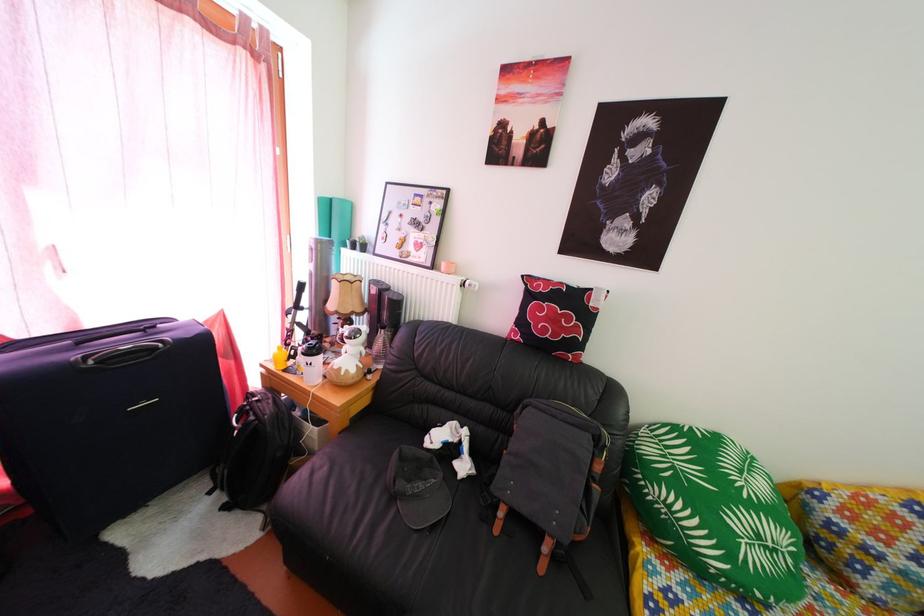
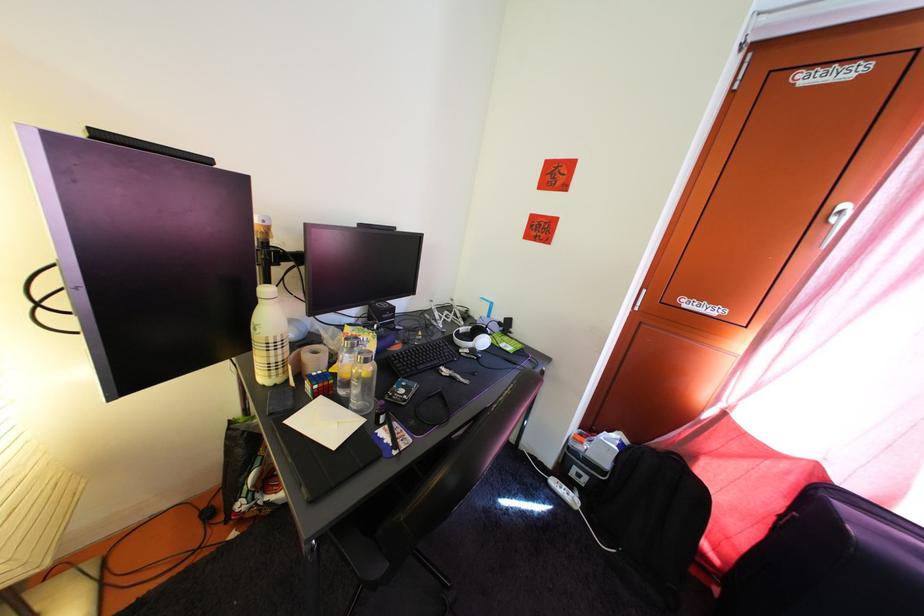
Question: The camera is either moving clockwise (left) or counter-clockwise (right) around the object. The first image is from the beginning of the video and the second image is from the end. Is the camera moving left or right when shooting the video?

Choices:
 (A) Left
 (B) Right

Answer: (B)